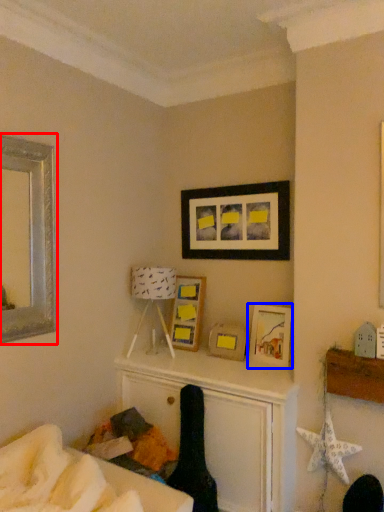
Question: Which point is closer to the camera, picture frame (highlighted by a red box) or picture frame (highlighted by a blue box)?

Choices:
 (A) picture frame
 (B) picture frame

Answer: (A)